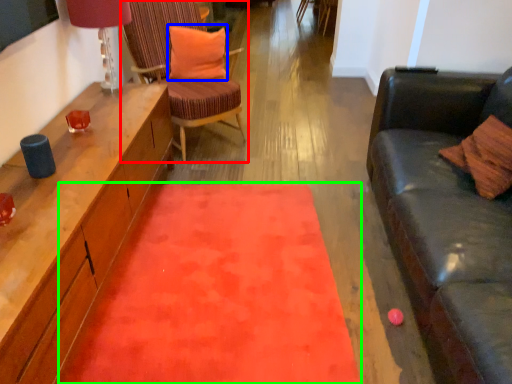
Question: Which object is the farthest from chair (highlighted by a red box)? Choose among these: pillow (highlighted by a blue box) or mat (highlighted by a green box).

Choices:
 (A) pillow
 (B) mat

Answer: (B)